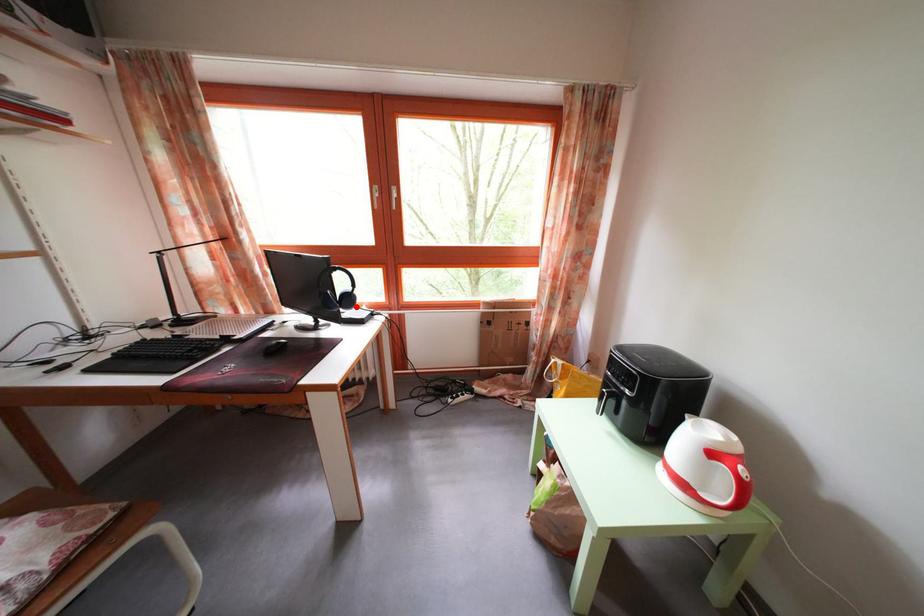
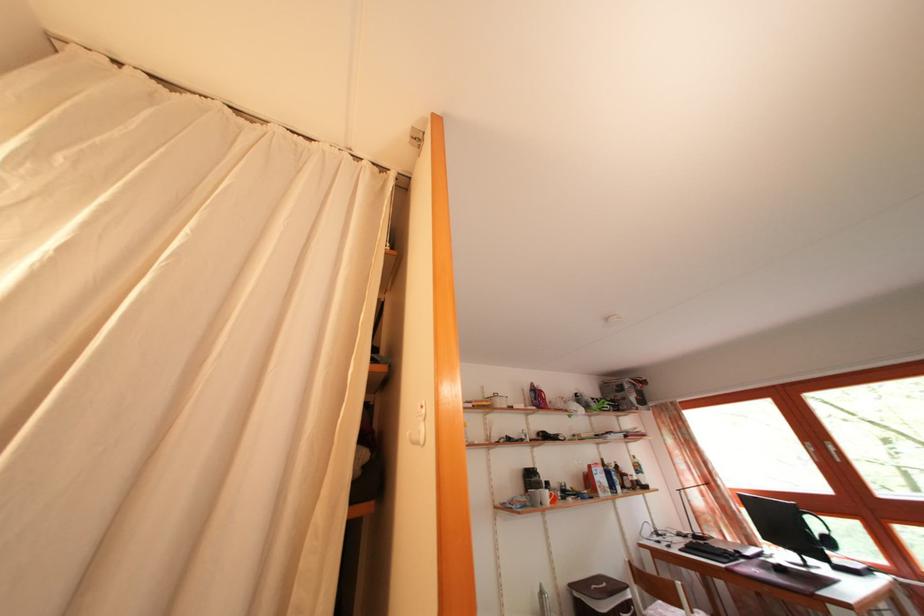
Find the pixel in the second image that matches the highlighted location in the first image.

(837, 549)